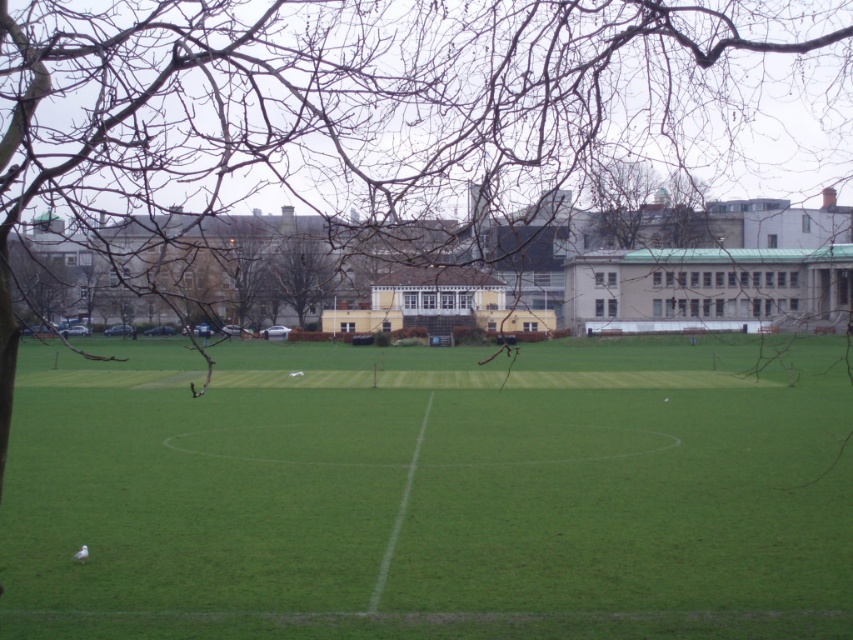
In the scene shown: You are a landscape architect designing a new sports field. You need to ensure that the green grass field at center will be wider than the brown leafless tree at center. Based on the image provided, is this requirement already met?

Yes, the green grass field at center is wider than the brown leafless tree at center according to the image description.

Consider the image. You are standing at the edge of the green grass field at center and want to take a photo of the brown leafless tree at center. Which direction should you face to have the tree in the frame while keeping the field as the main background?

The green grass field at center is positioned on the right side of the brown leafless tree at center, so you should face to the left to have the tree in the frame with the field as the main background.